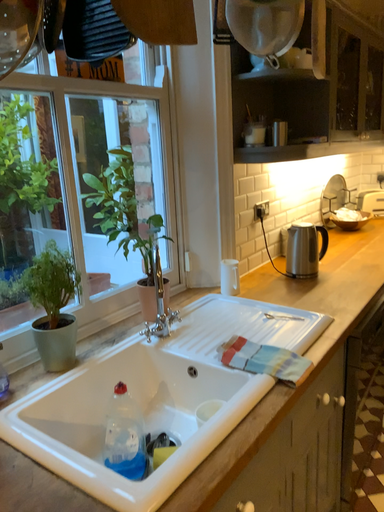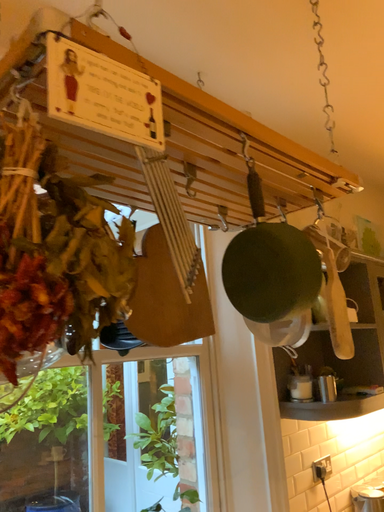
Question: Which way did the camera rotate in the video?

Choices:
 (A) rotated right
 (B) rotated left

Answer: (B)